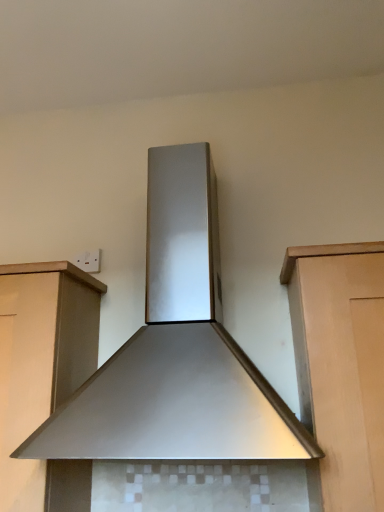
Describe the element at coordinates (176, 351) in the screenshot. This screenshot has height=512, width=384. I see `stainless steel range hood at center` at that location.

The height and width of the screenshot is (512, 384). I want to click on stainless steel range hood at center, so click(x=176, y=351).

Measure the distance between point (151, 162) and camera.

The depth of point (151, 162) is 4.26 feet.

What do you see at coordinates (46, 371) in the screenshot?
I see `matte wood cabinet at left` at bounding box center [46, 371].

Find the location of a particular element. matte wood cabinet at left is located at coordinates (46, 371).

At what (x,y) coordinates should I click in order to perform the action: click on stainless steel range hood at center. Please return your answer as a coordinate pair (x, y). This screenshot has width=384, height=512. Looking at the image, I should click on (176, 351).

Does stainless steel range hood at center appear on the left side of matte wood cabinet at left?

In fact, stainless steel range hood at center is to the right of matte wood cabinet at left.

Is stainless steel range hood at center positioned in front of matte wood cabinet at left?

Yes.

Is point (187, 241) behind point (18, 309)?

Yes, it is.

From the image's perspective, which is below, stainless steel range hood at center or matte wood cabinet at left?

From the image's view, matte wood cabinet at left is below.

From a real-world perspective, which object stands above the other?

stainless steel range hood at center, from a real-world perspective.

Is stainless steel range hood at center wider or thinner than matte wood cabinet at left?

Considering their sizes, stainless steel range hood at center looks broader than matte wood cabinet at left.

Which of these two, stainless steel range hood at center or matte wood cabinet at left, stands shorter?

matte wood cabinet at left.

In the scene shown: Does stainless steel range hood at center have a larger size compared to matte wood cabinet at left?

Yes, stainless steel range hood at center is bigger than matte wood cabinet at left.

Is stainless steel range hood at center inside the boundaries of matte wood cabinet at left, or outside?

stainless steel range hood at center is outside matte wood cabinet at left.

Is stainless steel range hood at center not close to matte wood cabinet at left?

That's not correct — stainless steel range hood at center is a little close to matte wood cabinet at left.

Is matte wood cabinet at left at the back of stainless steel range hood at center?

No.

The height and width of the screenshot is (512, 384). Identify the location of cabinetry that appears behind the stainless steel range hood at center. (46, 371).

Can you confirm if matte wood cabinet at left is positioned to the left of stainless steel range hood at center?

Indeed, matte wood cabinet at left is positioned on the left side of stainless steel range hood at center.

In the image, is matte wood cabinet at left positioned in front of or behind stainless steel range hood at center?

Clearly, matte wood cabinet at left is behind stainless steel range hood at center.

Which is further, (65, 467) or (276, 419)?

Point (65, 467)

From the image's perspective, which one is positioned lower, matte wood cabinet at left or stainless steel range hood at center?

From the image's view, matte wood cabinet at left is below.

From a real-world perspective, is matte wood cabinet at left physically located above or below stainless steel range hood at center?

In terms of real-world spatial position, matte wood cabinet at left is below stainless steel range hood at center.

Can you confirm if matte wood cabinet at left is thinner than stainless steel range hood at center?

Yes, matte wood cabinet at left is thinner than stainless steel range hood at center.

Between matte wood cabinet at left and stainless steel range hood at center, which one has less height?

matte wood cabinet at left is shorter.

Considering the sizes of objects matte wood cabinet at left and stainless steel range hood at center in the image provided, who is smaller, matte wood cabinet at left or stainless steel range hood at center?

matte wood cabinet at left is smaller.

Is stainless steel range hood at center a part of matte wood cabinet at left?

No, stainless steel range hood at center is located outside of matte wood cabinet at left.

Is matte wood cabinet at left far away from stainless steel range hood at center?

They are positioned close to each other.

Could you tell me if matte wood cabinet at left is facing stainless steel range hood at center?

No, matte wood cabinet at left is not oriented towards stainless steel range hood at center.

Can you tell me how much matte wood cabinet at left and stainless steel range hood at center differ in facing direction?

matte wood cabinet at left and stainless steel range hood at center are facing 1.13 degrees away from each other.

You are a GUI agent. You are given a task and a screenshot of the screen. Output one action in this format:
    pyautogui.click(x=<x>, y=<y>)
    Task: Click on the home appliance located above the matte wood cabinet at left (from the image's perspective)
    The height and width of the screenshot is (512, 384).
    Given the screenshot: What is the action you would take?
    pyautogui.click(x=176, y=351)

Where is `home appliance above the matte wood cabinet at left (from the image's perspective)`? The height and width of the screenshot is (512, 384). home appliance above the matte wood cabinet at left (from the image's perspective) is located at coordinates (176, 351).

Where is `home appliance in front of the matte wood cabinet at left`? home appliance in front of the matte wood cabinet at left is located at coordinates (176, 351).